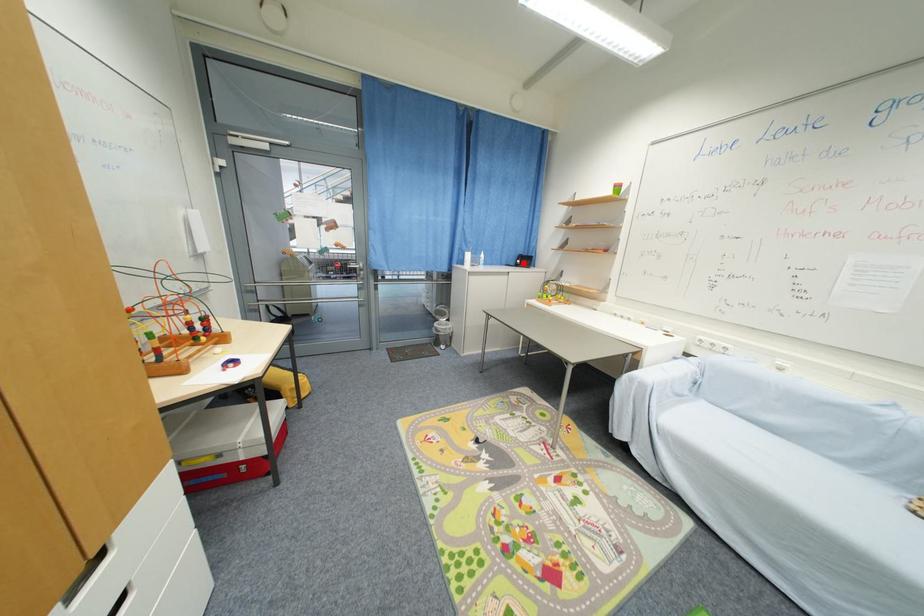
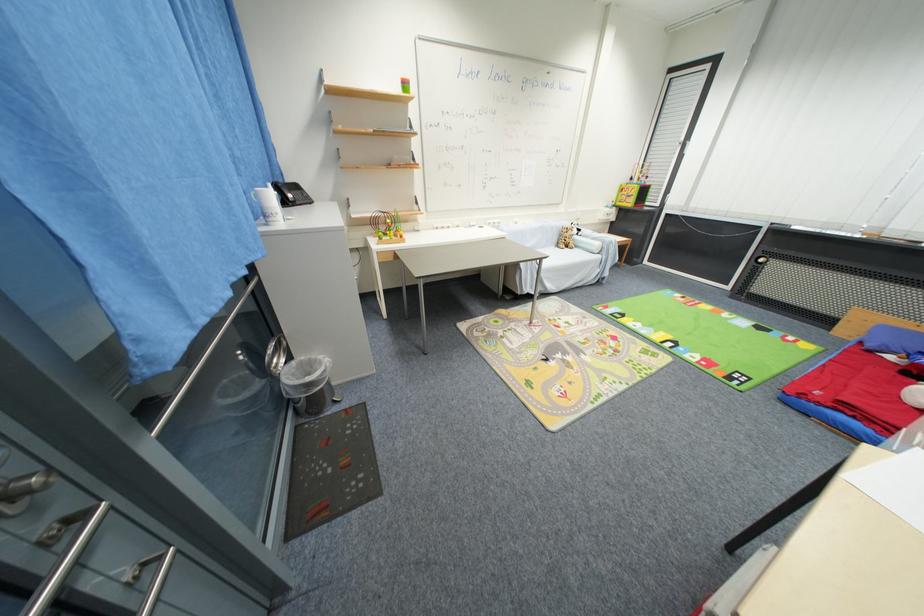
Locate, in the second image, the point that corresponds to the highlighted location in the first image.

(296, 198)